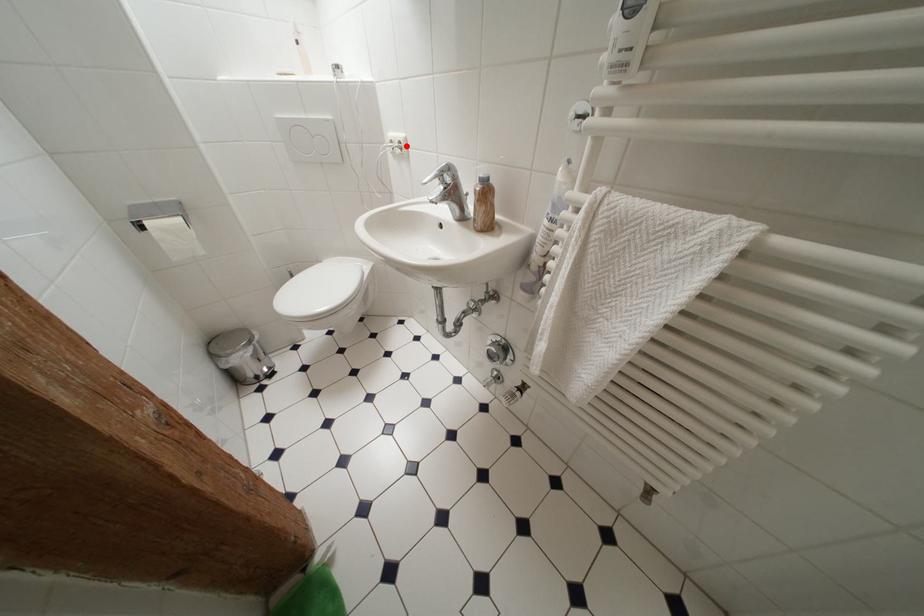
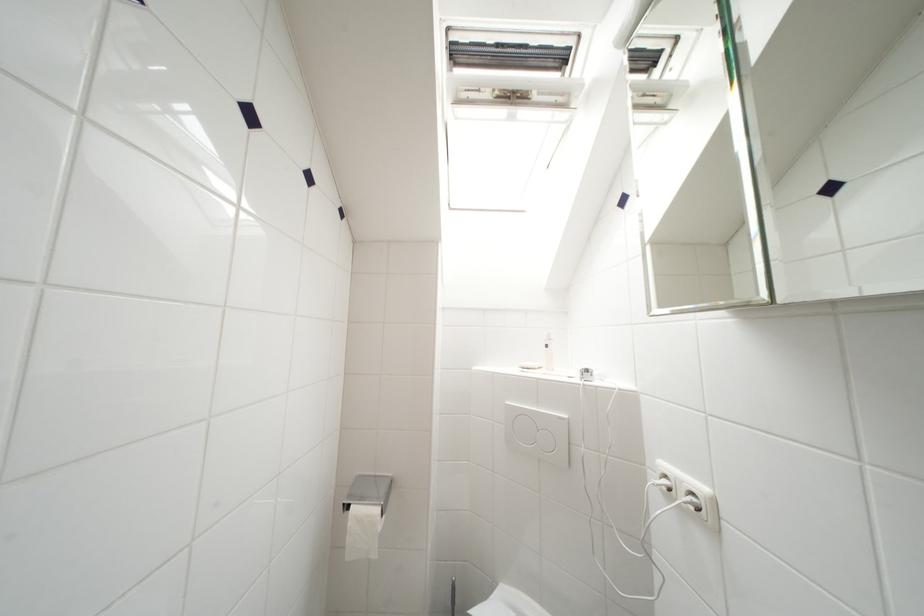
Where in the second image is the point corresponding to the highlighted location from the first image?

(699, 498)